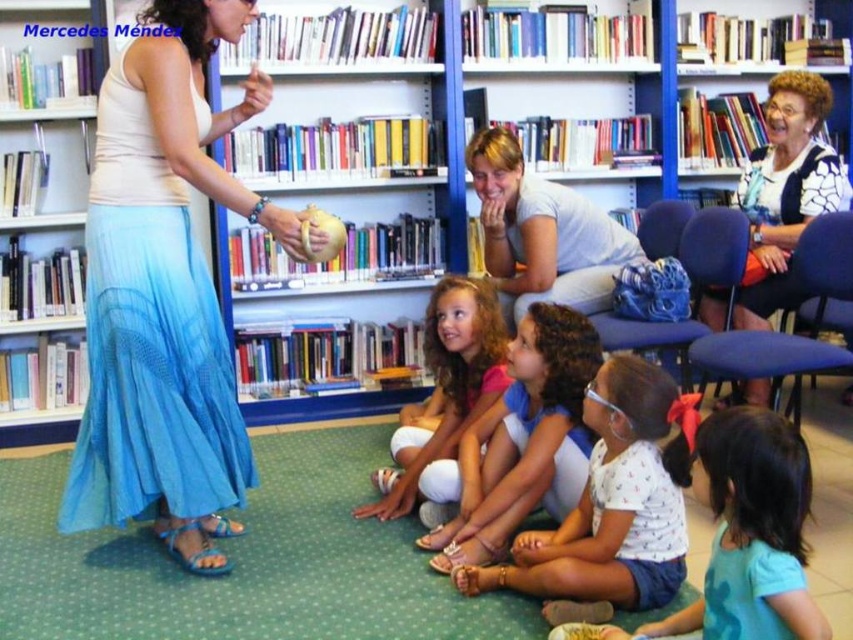
Question: Is white cotton shirt at center positioned at the back of white cotton shirt at lower center?

Choices:
 (A) yes
 (B) no

Answer: (A)

Question: Which point is farther from the camera taking this photo?

Choices:
 (A) (677, 444)
 (B) (508, 387)
 (C) (405, 496)
 (D) (520, 164)

Answer: (D)

Question: Which of the following is the farthest from the observer?

Choices:
 (A) (534, 241)
 (B) (769, 260)
 (C) (329, 209)

Answer: (C)

Question: Which point is closer to the camera?

Choices:
 (A) click(x=619, y=604)
 (B) click(x=525, y=97)
 (C) click(x=747, y=509)

Answer: (C)

Question: Considering the relative positions of blue wooden bookcase at center and matte white shirt at center in the image provided, where is blue wooden bookcase at center located with respect to matte white shirt at center?

Choices:
 (A) above
 (B) below

Answer: (A)

Question: Is matte white shirt at center above white printed blouse at upper right?

Choices:
 (A) no
 (B) yes

Answer: (A)